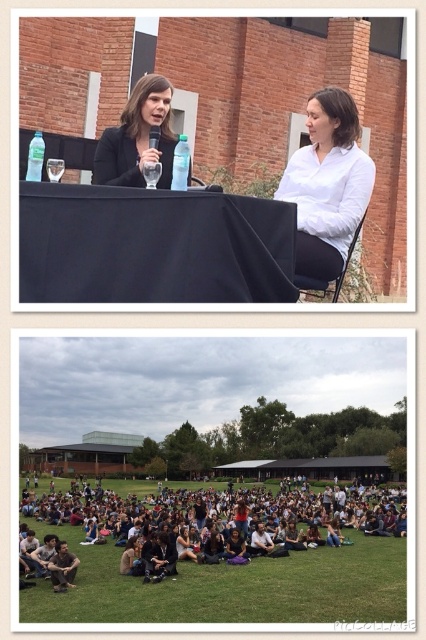
You are a photographer who wants to take a closeup shot of the clear plastic bottle at center without the dark brown hair at lower center blocking the view. Is it possible to do so without moving any objects?

The dark brown hair at lower center is further to the viewer than clear plastic bottle at center, so it is blocking the bottle. Therefore, it is not possible to take a clear photo of the clear plastic bottle at center without moving the dark brown hair at lower center.

In the top photograph of the collage, you notice two objects labeled as dark brown hair at lower center and clear glass wine glass at upper center. Which of these two objects is taller?

The dark brown hair at lower center is taller than the clear glass wine glass at upper center according to the description provided.